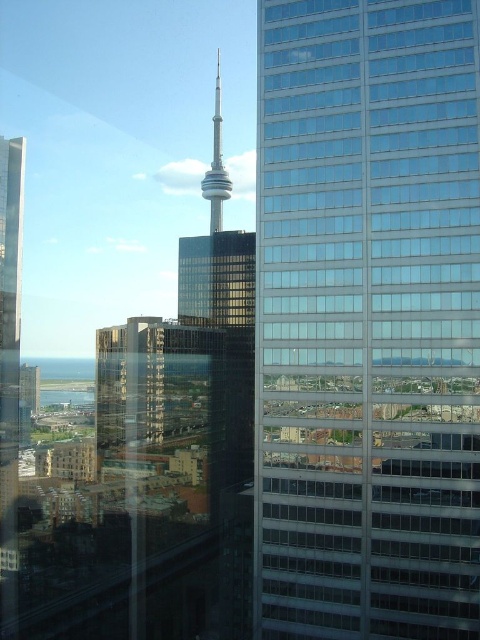
Question: Which of the following is the closest to the observer?

Choices:
 (A) shiny glass tower at center
 (B) glassy reflective skyscraper at center

Answer: (B)

Question: Does glassy reflective skyscraper at center have a smaller size compared to shiny glass tower at center?

Choices:
 (A) yes
 (B) no

Answer: (A)

Question: Which point is farther to the camera?

Choices:
 (A) shiny glass tower at center
 (B) glassy reflective skyscraper at center

Answer: (A)

Question: Is glassy reflective skyscraper at center further to the viewer compared to shiny glass tower at center?

Choices:
 (A) no
 (B) yes

Answer: (A)

Question: Does glassy reflective skyscraper at center appear under shiny glass tower at center?

Choices:
 (A) yes
 (B) no

Answer: (A)